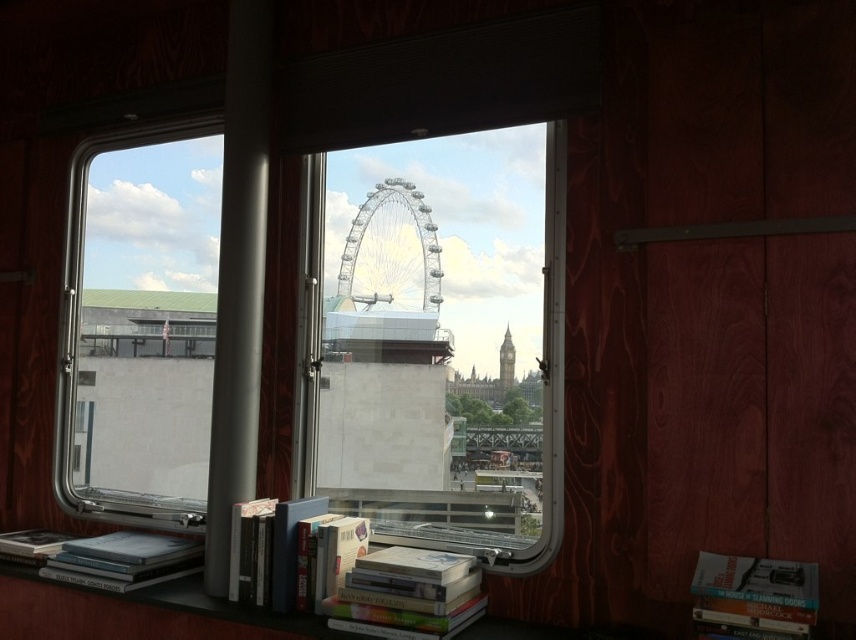
Consider the image. Does clear glass window at upper left appear on the left side of hardcover book at center?

Correct, you'll find clear glass window at upper left to the left of hardcover book at center.

Measure the distance between point (128, 330) and camera.

Point (128, 330) and camera are 2.84 meters apart.

Is point (186, 244) less distant than point (289, 547)?

No.

Find the location of a particular element. Image resolution: width=856 pixels, height=640 pixels. clear glass window at upper left is located at coordinates (138, 324).

Is point (395, 220) positioned before point (334, 573)?

No.

Between clear glass window at center and hardcover book at center, which one is positioned higher?

clear glass window at center is higher up.

Which is behind, point (397, 401) or point (262, 522)?

Positioned behind is point (397, 401).

Identify the location of clear glass window at center. (437, 337).

Is clear glass window at center below clear glass window at upper left?

Indeed, clear glass window at center is positioned under clear glass window at upper left.

Which is below, clear glass window at center or clear glass window at upper left?

clear glass window at center is below.

Is point (528, 156) more distant than point (150, 364)?

No.

Identify the location of clear glass window at center. (437, 337).